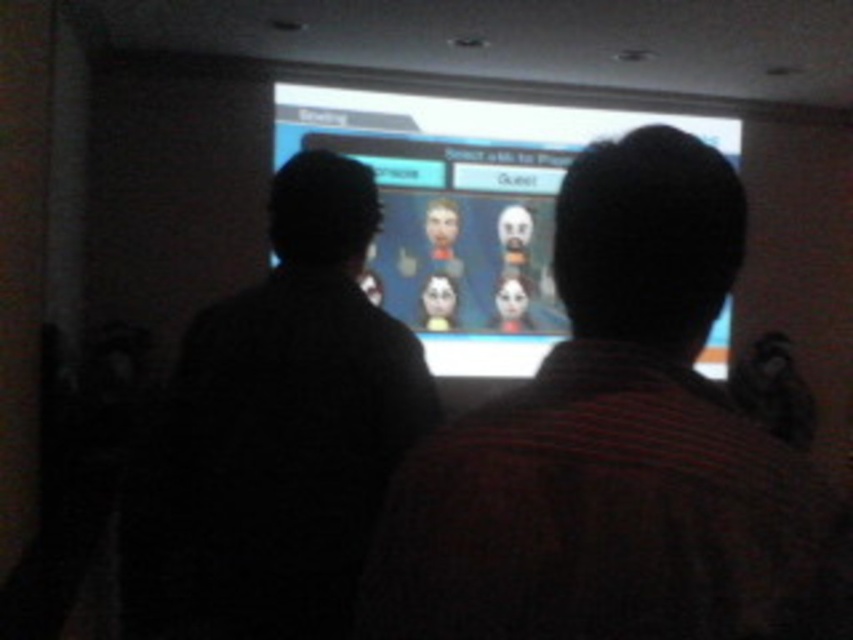
You are trying to decide which shirt to wear for a casual day out. You have two options in front of you on a table in the room. The striped fabric shirt at center and the black matte shirt at left. Based on their sizes, which one is narrower?

The striped fabric shirt at center is narrower than the black matte shirt at left because its width is less than the black matte shirt at left.

You are a game developer observing the scene. You need to ensure that the black matte shirt at left and the matte plastic screen at center are visible to players. Given that the screen is brighter, which object might be more noticeable to someone entering the dimly lit room?

The matte plastic screen at center is brighter and larger than the black matte shirt at left, making it more noticeable to someone entering the dimly lit room.

You are a game developer observing the two individuals in the gaming area. You notice the striped fabric shirt at center and the matte plastic screen at center. Which object is larger in size?

The striped fabric shirt at center is smaller than the matte plastic screen at center, so the matte plastic screen at center is larger in size.